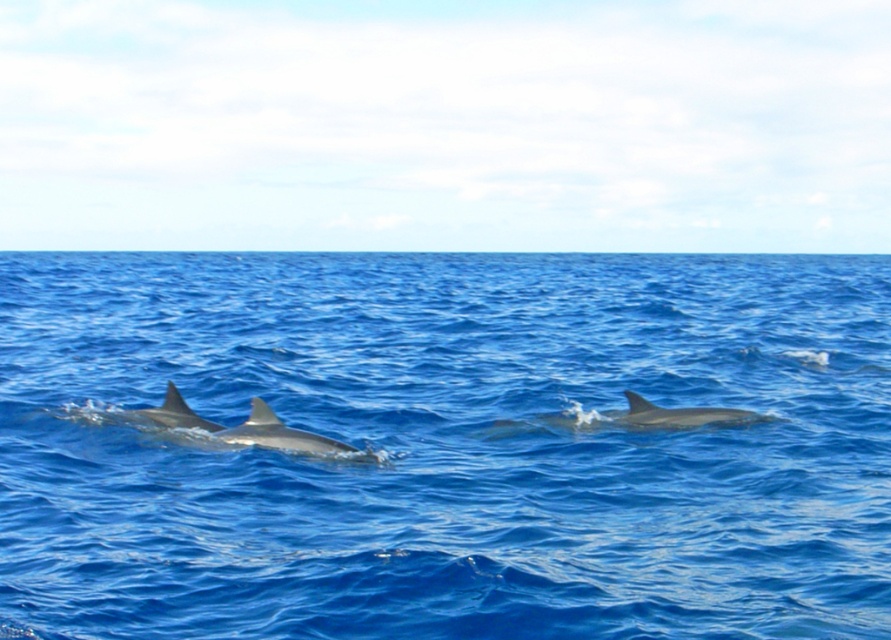
Question: Which point is farther from the camera taking this photo?

Choices:
 (A) (x=260, y=404)
 (B) (x=616, y=412)

Answer: (B)

Question: Does blue smooth water at center have a smaller size compared to gray smooth dolphin at center?

Choices:
 (A) no
 (B) yes

Answer: (A)

Question: Considering the relative positions of blue smooth water at center and gray smooth dolphin at center in the image provided, where is blue smooth water at center located with respect to gray smooth dolphin at center?

Choices:
 (A) above
 (B) below

Answer: (A)

Question: Is blue smooth water at center further to the viewer compared to gray smooth dolphin at center?

Choices:
 (A) yes
 (B) no

Answer: (B)

Question: Which of the following is the closest to the observer?

Choices:
 (A) gray smooth dolphin at center
 (B) blue smooth water at center

Answer: (B)

Question: Which of the following is the farthest from the observer?

Choices:
 (A) (851, 582)
 (B) (266, 444)
 (C) (563, 426)

Answer: (C)